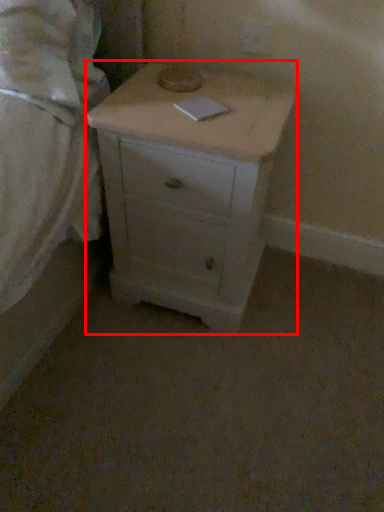
Question: From the image's perspective, what is the correct spatial relationship of chest of drawers (annotated by the red box) in relation to bed?

Choices:
 (A) above
 (B) below

Answer: (B)